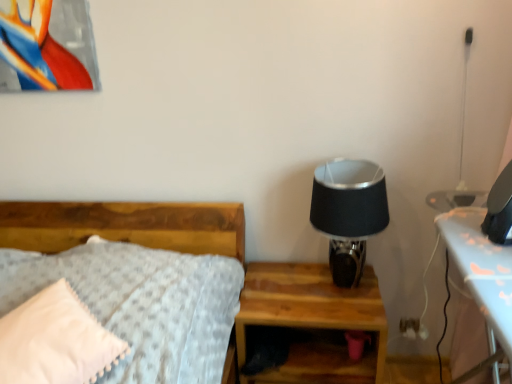
You are a GUI agent. You are given a task and a screenshot of the screen. Output one action in this format:
    pyautogui.click(x=<x>, y=<y>)
    Task: Click on the free location to the left of black fabric lampshade at upper right
    Image resolution: width=512 pixels, height=384 pixels.
    Given the screenshot: What is the action you would take?
    pyautogui.click(x=281, y=287)